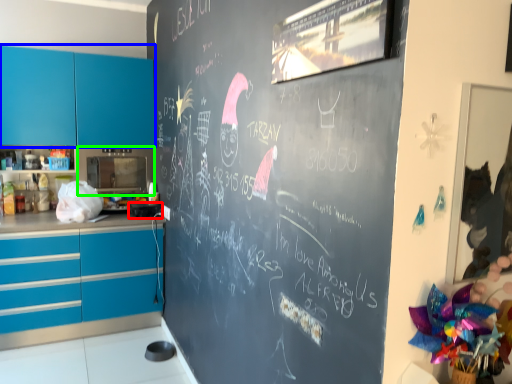
Question: Based on their relative distances, which object is farther from appliance (highlighted by a red box)? Choose from cabinetry (highlighted by a blue box) and appliance (highlighted by a green box).

Choices:
 (A) cabinetry
 (B) appliance

Answer: (A)